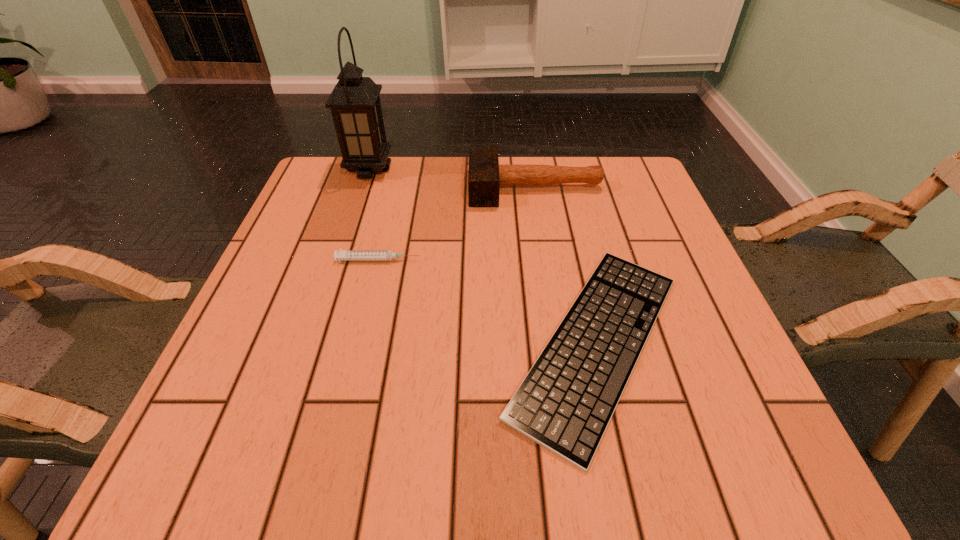
At what (x,y) coordinates should I click in order to perform the action: click on lantern. Please return your answer as a coordinate pair (x, y). This screenshot has height=540, width=960. Looking at the image, I should click on (355, 105).

This screenshot has width=960, height=540. In order to click on mallet in this screenshot , I will do `click(485, 175)`.

What are the coordinates of `syringe` in the screenshot? It's located at (344, 255).

Locate an element on the screen. The image size is (960, 540). the shortest object is located at coordinates (565, 403).

Identify the location of vacant point located 0.160m on the right of the tallest object. This screenshot has height=540, width=960. (451, 169).

Where is `vacant space situated on the hammer head face of the second tallest object`? Image resolution: width=960 pixels, height=540 pixels. vacant space situated on the hammer head face of the second tallest object is located at coordinates (378, 187).

What are the coordinates of `vacant area located 0.170m on the hammer head face of the second tallest object` in the screenshot? It's located at (402, 187).

You are a GUI agent. You are given a task and a screenshot of the screen. Output one action in this format:
    pyautogui.click(x=<x>, y=<y>)
    Task: Click on the free space located 0.140m on the hammer head face of the second tallest object
    The height and width of the screenshot is (540, 960).
    Given the screenshot: What is the action you would take?
    pyautogui.click(x=414, y=187)

Locate an element on the screen. This screenshot has width=960, height=540. free space located 0.190m at the needle end of the second shortest object is located at coordinates (511, 260).

Locate an element on the screen. This screenshot has width=960, height=540. free space located 0.200m on the left of the computer keyboard is located at coordinates (382, 343).